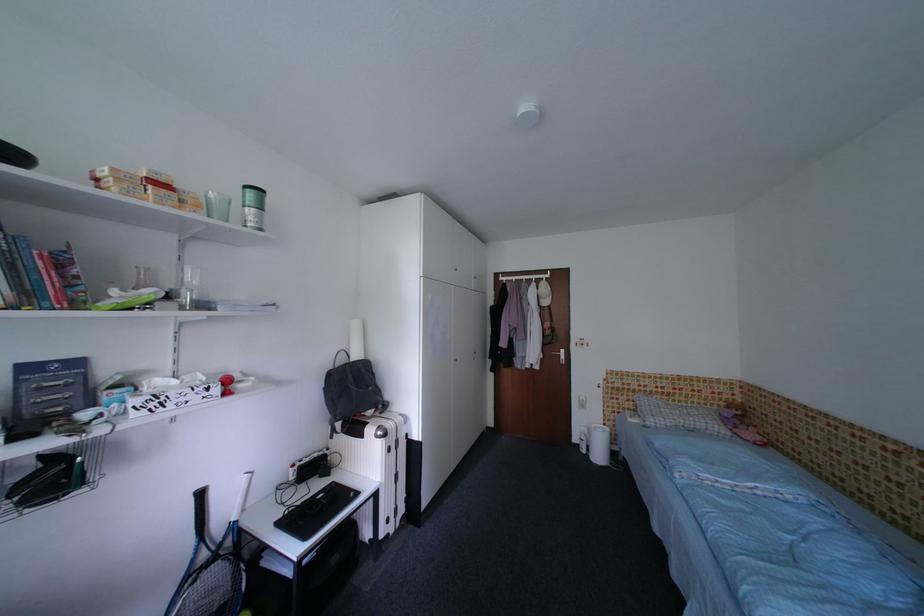
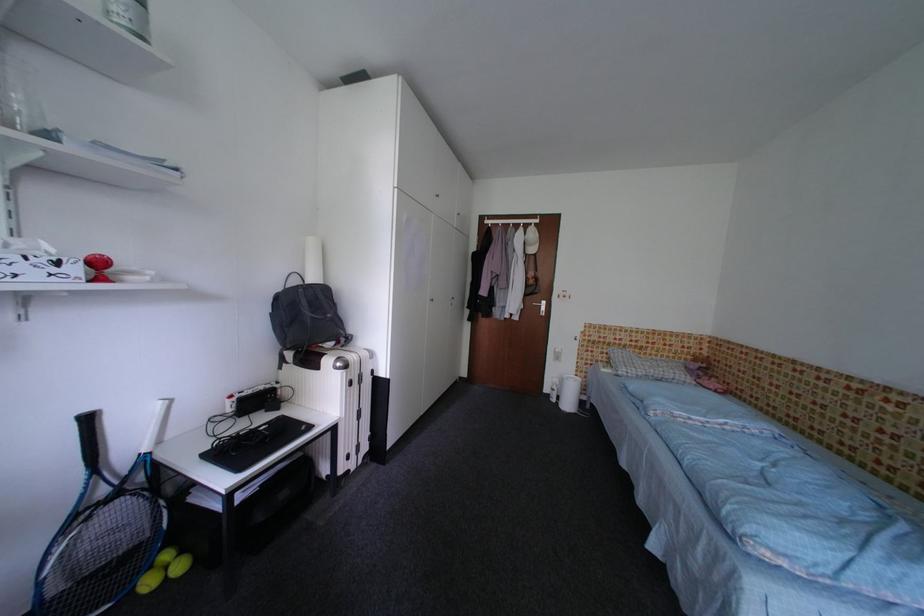
Find the pixel in the second image that matches (225,392) in the first image.

(83, 272)